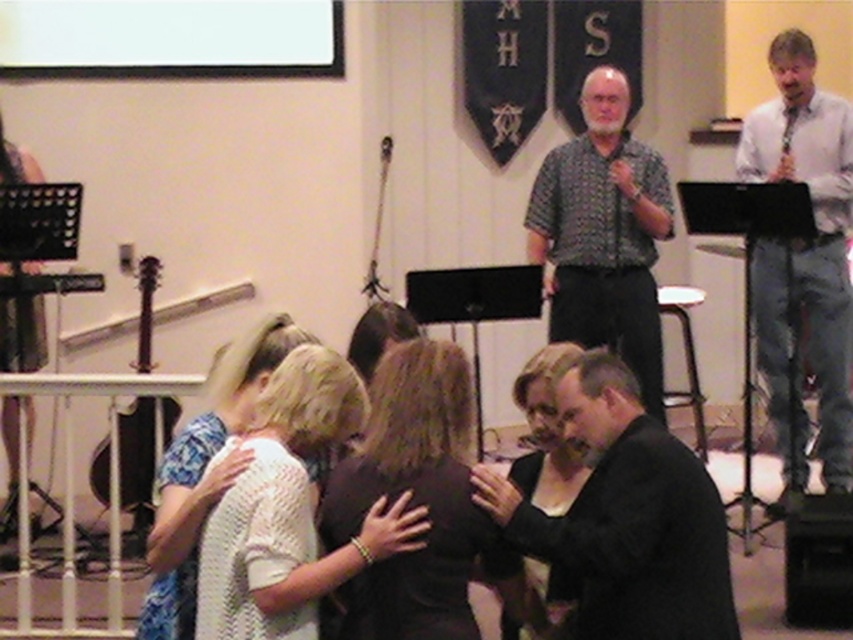
Between white knitted sweater at lower left and black wood guitar at left, which one is positioned lower?

Positioned lower is white knitted sweater at lower left.

Between white knitted sweater at lower left and black wood guitar at left, which one is positioned higher?

black wood guitar at left is higher up.

Between point (305, 332) and point (144, 410), which one is positioned in front?

Positioned in front is point (305, 332).

This screenshot has height=640, width=853. What are the coordinates of `white knitted sweater at lower left` in the screenshot? It's located at (204, 472).

Image resolution: width=853 pixels, height=640 pixels. Find the location of `white knitted sweater at center`. white knitted sweater at center is located at coordinates (289, 509).

Does white knitted sweater at center lie in front of black wood guitar at left?

Yes.

The width and height of the screenshot is (853, 640). In order to click on white knitted sweater at center in this screenshot , I will do `click(289, 509)`.

This screenshot has width=853, height=640. Find the location of `white knitted sweater at center`. white knitted sweater at center is located at coordinates (289, 509).

What do you see at coordinates (602, 234) in the screenshot?
I see `checkered shirt at center` at bounding box center [602, 234].

Does checkered shirt at center have a lesser height compared to white knitted sweater at lower left?

No.

Locate an element on the screen. checkered shirt at center is located at coordinates (602, 234).